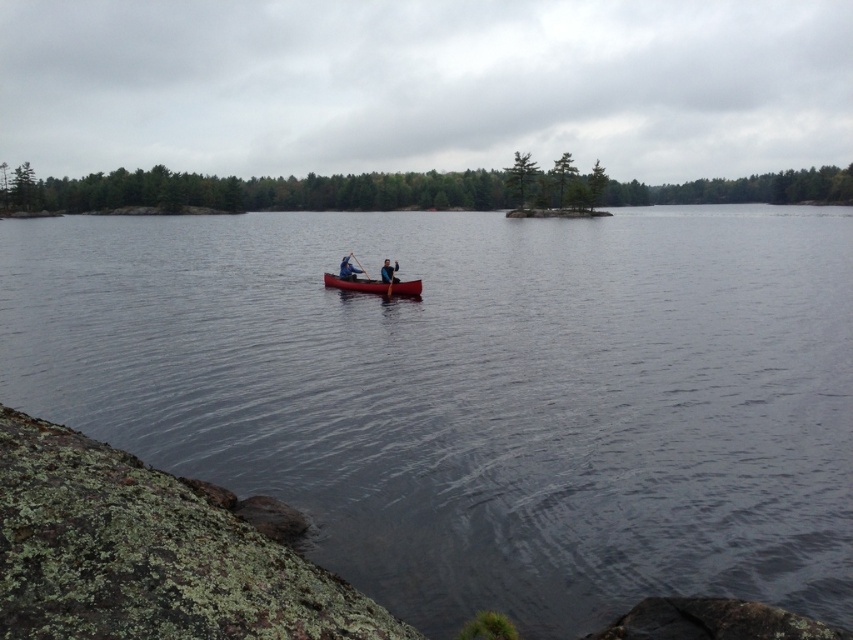
Is matte red canoe at center to the right of blue fabric person at center from the viewer's perspective?

No, matte red canoe at center is not to the right of blue fabric person at center.

The image size is (853, 640). Find the location of `matte red canoe at center`. matte red canoe at center is located at coordinates (374, 285).

The height and width of the screenshot is (640, 853). Identify the location of matte red canoe at center. (374, 285).

The height and width of the screenshot is (640, 853). Identify the location of matte red canoe at center. pos(374,285).

Is blue fabric person at center wider than wooden paddle at center?

No.

Is blue fabric person at center smaller than wooden paddle at center?

Yes, blue fabric person at center is smaller than wooden paddle at center.

The height and width of the screenshot is (640, 853). I want to click on blue fabric person at center, so click(x=387, y=272).

Where is `blue fabric person at center`? blue fabric person at center is located at coordinates (387, 272).

Between point (51, 396) and point (354, 257), which one is positioned in front?

Positioned in front is point (51, 396).

Which of these two, dark gray water at center or wooden paddle at center, stands taller?

dark gray water at center is taller.

Where is `dark gray water at center`? The height and width of the screenshot is (640, 853). dark gray water at center is located at coordinates (476, 394).